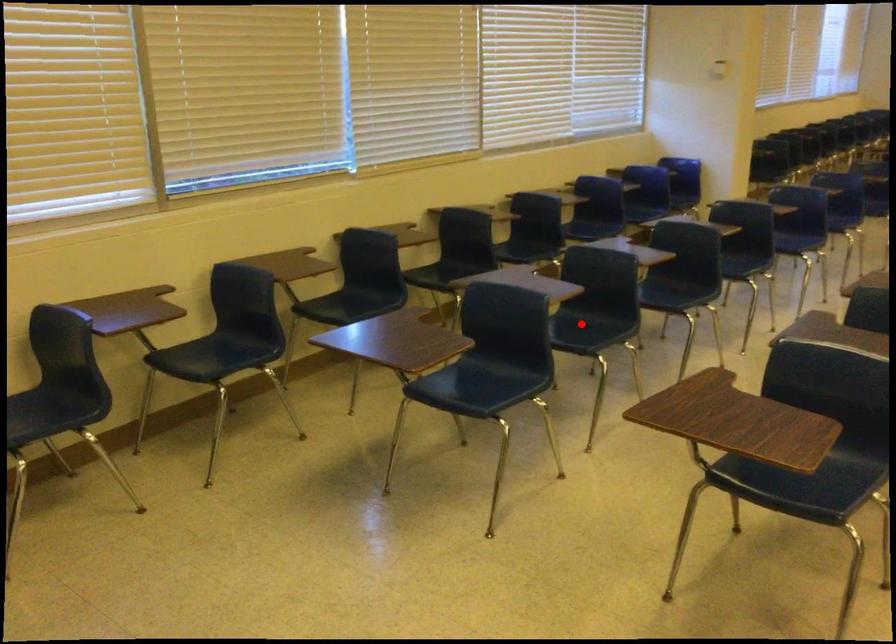
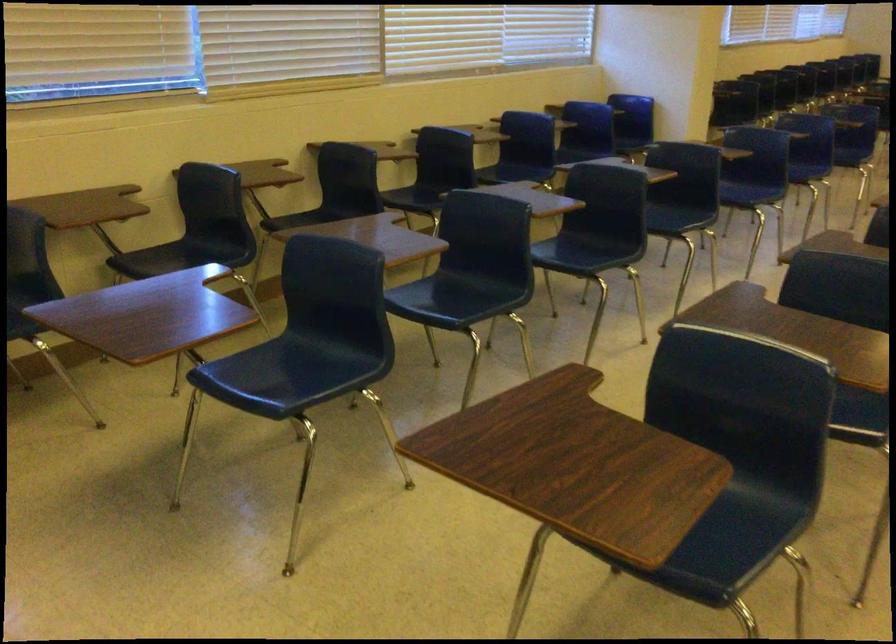
Locate, in the second image, the point that corresponds to the highlighted location in the first image.

(462, 292)